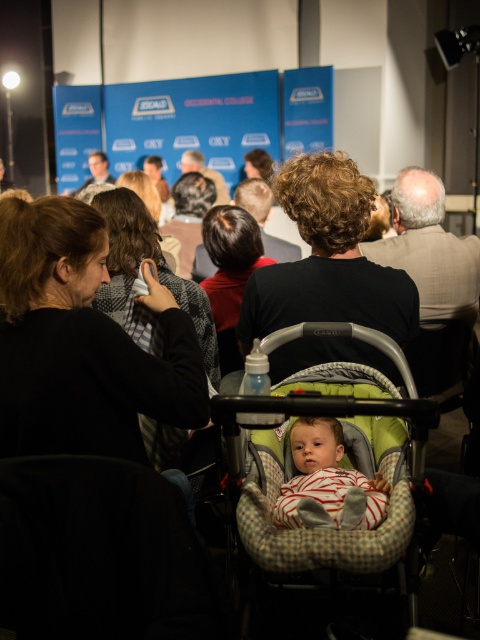
Measure the distance from plaid fabric baby carriage at center to striped fabric baby at center.

plaid fabric baby carriage at center and striped fabric baby at center are 11.74 centimeters apart from each other.

Between plaid fabric baby carriage at center and striped fabric baby at center, which one has less height?

striped fabric baby at center

Identify the location of plaid fabric baby carriage at center. Image resolution: width=480 pixels, height=640 pixels. (332, 396).

Locate an element on the screen. plaid fabric baby carriage at center is located at coordinates (332, 396).